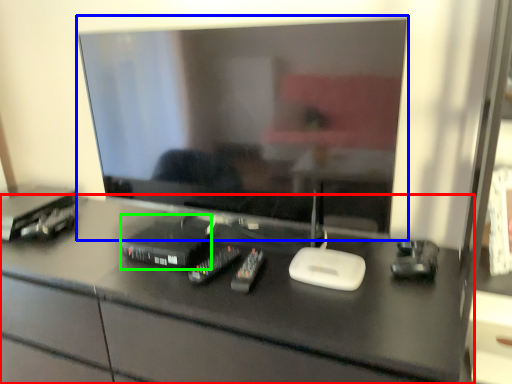
Question: Based on their relative distances, which object is nearer to desk (highlighted by a red box)? Choose from television (highlighted by a blue box) and equipment (highlighted by a green box).

Choices:
 (A) television
 (B) equipment

Answer: (B)